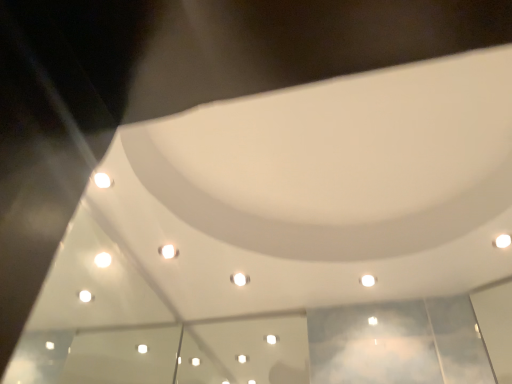
Question: Does white glossy light at center, the first light viewed from the left, have a larger size compared to white glossy light at upper right, the third light positioned from the bottom?

Choices:
 (A) no
 (B) yes

Answer: (B)

Question: Is white glossy light at center, which is the third light in top-to-bottom order, closer to camera compared to white glossy light at upper right, the 3th light viewed from the left?

Choices:
 (A) no
 (B) yes

Answer: (A)

Question: From the image's perspective, is white glossy light at center, marked as the 3th light in a right-to-left arrangement, beneath white glossy light at upper right, which appears as the third light when viewed from the back?

Choices:
 (A) yes
 (B) no

Answer: (A)

Question: Are white glossy light at center, the first light from the bottom, and white glossy light at upper right, which appears as the 1th light when viewed from the front, far apart?

Choices:
 (A) no
 (B) yes

Answer: (A)

Question: Can you confirm if white glossy light at center, the third light when ordered from front to back, is positioned to the right of white glossy light at upper right, the 3th light viewed from the left?

Choices:
 (A) yes
 (B) no

Answer: (B)

Question: Would you say white glossy light at center, the first light viewed from the left, is inside or outside white glossy light at upper center, acting as the 2th light starting from the right?

Choices:
 (A) inside
 (B) outside

Answer: (B)

Question: From the image's perspective, is white glossy light at center, which ranks as the first light in back-to-front order, located above or below white glossy light at upper center, which is the 2th light from back to front?

Choices:
 (A) below
 (B) above

Answer: (A)

Question: Is white glossy light at center, which ranks as the first light in back-to-front order, bigger or smaller than white glossy light at upper center, acting as the 2th light starting from the right?

Choices:
 (A) big
 (B) small

Answer: (A)

Question: From a real-world perspective, is white glossy light at center, which ranks as the first light in back-to-front order, physically located above or below white glossy light at upper center, which is counted as the 2th light, starting from the top?

Choices:
 (A) below
 (B) above

Answer: (A)

Question: In terms of height, does white glossy light at upper right, which appears as the third light when viewed from the back, look taller or shorter compared to white glossy light at upper center, arranged as the second light when viewed from the left?

Choices:
 (A) tall
 (B) short

Answer: (A)

Question: In the image, is white glossy light at upper right, the 1th light positioned from the top, on the left side or the right side of white glossy light at upper center, placed as the 2th light when sorted from front to back?

Choices:
 (A) left
 (B) right

Answer: (B)

Question: Considering the positions of white glossy light at upper right, which appears as the 1th light when viewed from the front, and white glossy light at upper center, placed as the 2th light when sorted from front to back, in the image, is white glossy light at upper right, which appears as the 1th light when viewed from the front, bigger or smaller than white glossy light at upper center, placed as the 2th light when sorted from front to back,?

Choices:
 (A) big
 (B) small

Answer: (A)

Question: From a real-world perspective, relative to white glossy light at upper center, which is counted as the 2th light, starting from the top, is white glossy light at upper right, the 3th light viewed from the left, vertically above or below?

Choices:
 (A) below
 (B) above

Answer: (B)

Question: From a real-world perspective, relative to white glossy light at center, which ranks as the first light in back-to-front order, is white glossy light at upper right, which appears as the third light when viewed from the back, vertically above or below?

Choices:
 (A) below
 (B) above

Answer: (B)

Question: In terms of width, does white glossy light at upper right, the 1th light positioned from the top, look wider or thinner when compared to white glossy light at center, the third light when ordered from front to back?

Choices:
 (A) thin
 (B) wide

Answer: (A)